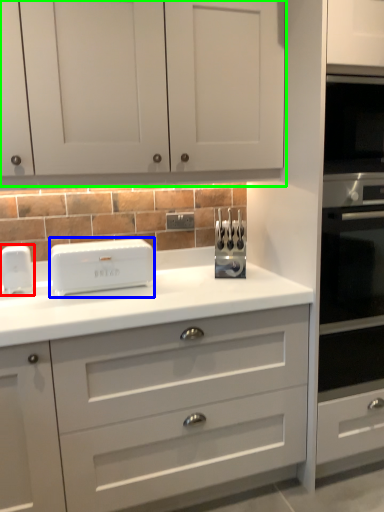
Question: Considering the real-world distances, which object is closest to home appliance (highlighted by a red box)? home appliance (highlighted by a blue box) or cabinetry (highlighted by a green box).

Choices:
 (A) home appliance
 (B) cabinetry

Answer: (A)